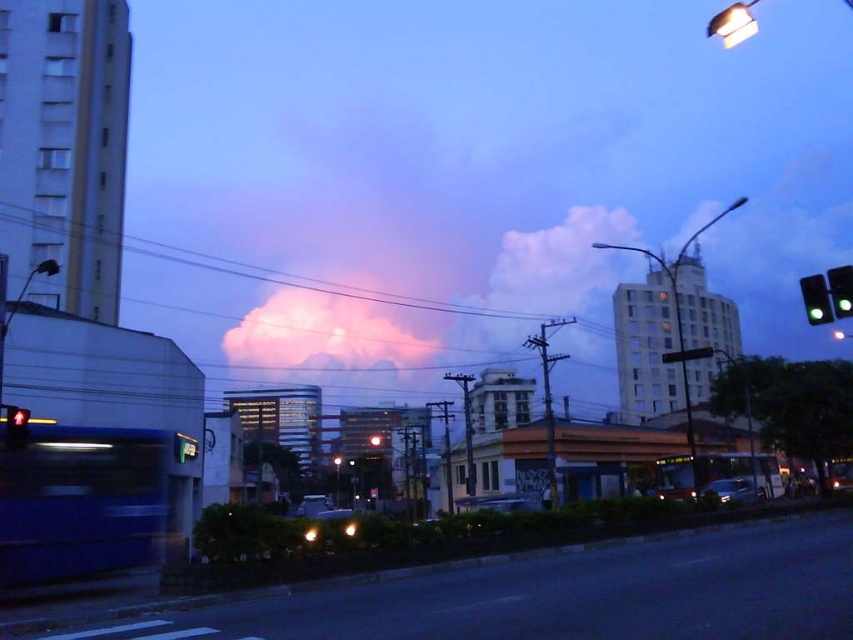
Does pink fluffy cloud at upper center appear over red glass pedestrian signal at left?

Indeed, pink fluffy cloud at upper center is positioned over red glass pedestrian signal at left.

What do you see at coordinates (323, 330) in the screenshot?
I see `pink fluffy cloud at upper center` at bounding box center [323, 330].

Who is more distant from viewer, (276, 337) or (16, 412)?

Positioned behind is point (276, 337).

Locate an element on the screen. The image size is (853, 640). pink fluffy cloud at upper center is located at coordinates (323, 330).

Does green glass traffic light at upper right have a smaller size compared to red glass pedestrian signal at left?

Incorrect, green glass traffic light at upper right is not smaller in size than red glass pedestrian signal at left.

How far apart are green glass traffic light at upper right and red glass pedestrian signal at left?

46.53 meters

Describe the element at coordinates (816, 300) in the screenshot. I see `green glass traffic light at upper right` at that location.

I want to click on green glass traffic light at upper right, so click(x=816, y=300).

Is pink fluffy cloud at upper center taller than green glass traffic light at upper right?

Yes.

Which is more to the right, pink fluffy cloud at upper center or green glass traffic light at upper right?

From the viewer's perspective, green glass traffic light at upper right appears more on the right side.

Which is behind, point (346, 371) or point (815, 305)?

The point (346, 371) is more distant.

Where is `pink fluffy cloud at upper center`? The image size is (853, 640). pink fluffy cloud at upper center is located at coordinates (323, 330).